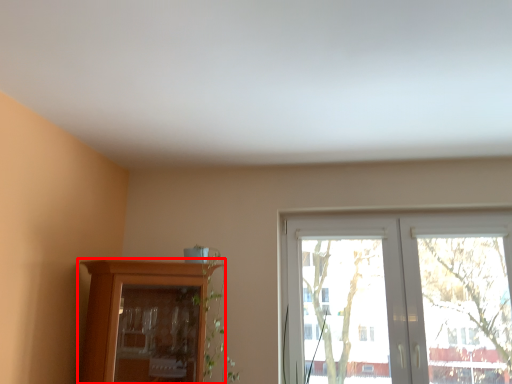
Question: From the image's perspective, what is the correct spatial positioning of cupboard (annotated by the red box) in reference to window?

Choices:
 (A) below
 (B) above

Answer: (A)